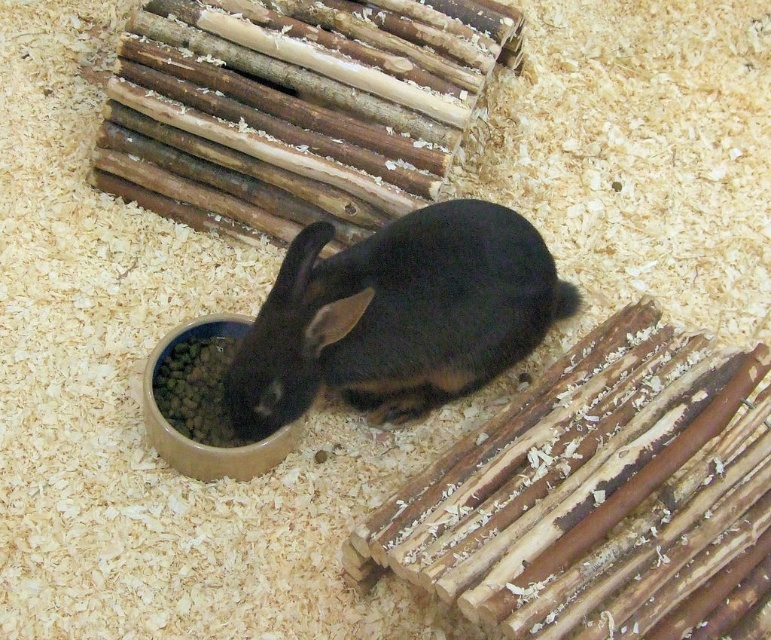
You are a pet owner who wants to ensure the black matte rabbit at center can reach its food in the brown matte bowl at lower center. Based on the scene description, will the rabbit need to stand on its hind legs to eat?

The black matte rabbit at center is much taller than the brown matte bowl at lower center, so the rabbit would need to stand on its hind legs to reach the bowl.

You are standing in front of a rabbit enclosure and want to reach a point exactly 5.68 feet away from your current position. Can you confirm if this point is located at the coordinates point (x=483, y=333)?

The distance between point (x=483, y=333) and the viewer is 5.68 feet, so yes, the point at coordinates point (x=483, y=333) is exactly 5.68 feet away from your current position.

You are a caretaker of a small black rabbit in a wooden enclosure. You need to place a new feeding bowl for the rabbit. The enclosure has a coordinate system where the bottom left corner is the origin point. The rabbit is currently at position black matte rabbit at center. Where should you place the new feeding bowl to ensure it is at least 0.3 units away from the rabbit?

The black matte rabbit at center is at position point [396,316]. To place the new feeding bowl at least 0.3 units away, you can choose a location such as point [385,512] which is 0.305 units away horizontally from the rabbit, ensuring sufficient distance.